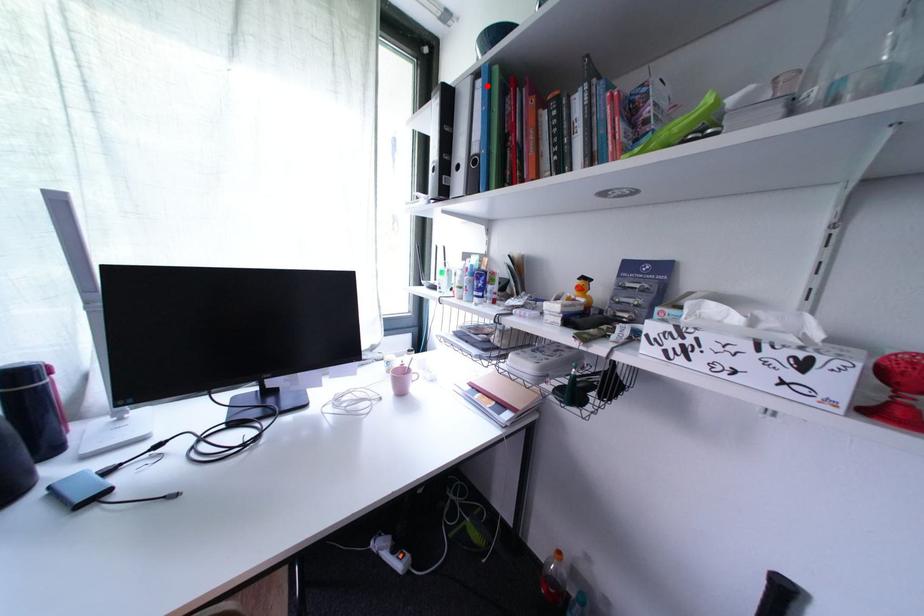
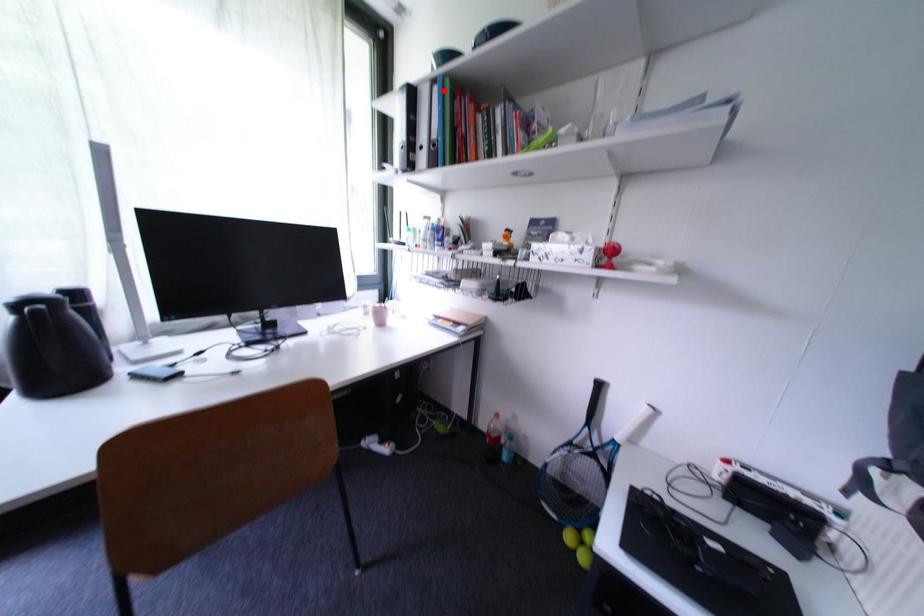
I am providing you with two images of the same scene from different viewpoints. A red point is marked on the first image and another point is marked on the second image. Is the marked point in image1 the same physical position as the marked point in image2?

Yes